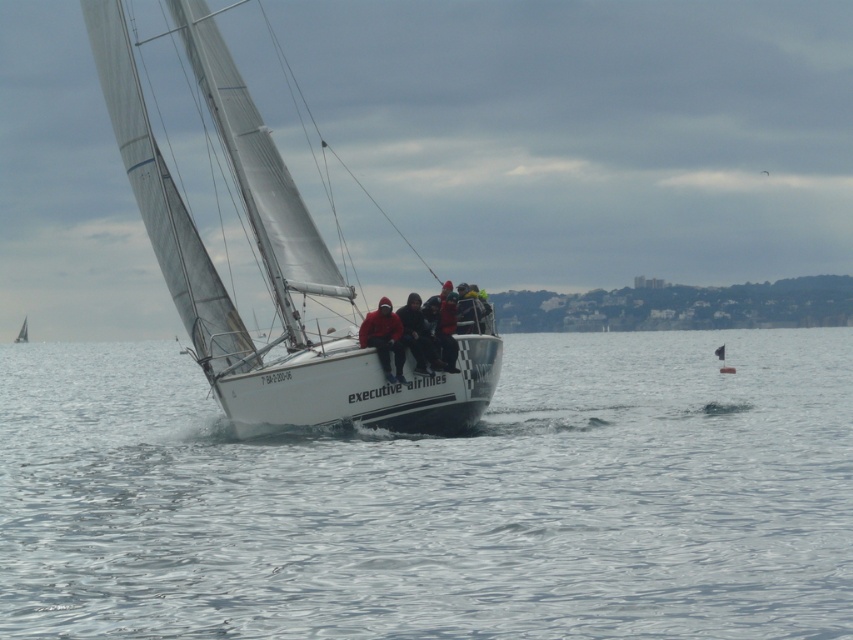
Question: Which is nearer to the clear water at sailboat front?

Choices:
 (A) dark blue fabric jacket at center
 (B) white sailboat at center

Answer: (A)

Question: Which of these objects is positioned farthest from the white matte sailboat at center?

Choices:
 (A) clear water at sailboat front
 (B) red fleece jackets at center
 (C) red fleece jacket at center

Answer: (A)

Question: Which point appears closest to the camera in this image?

Choices:
 (A) (25, 337)
 (B) (173, 216)
 (C) (366, 342)

Answer: (C)

Question: Does red fleece jacket at center have a greater width compared to dark blue fabric jacket at center?

Choices:
 (A) no
 (B) yes

Answer: (B)

Question: Can you confirm if white matte sailboat at center is wider than white sailboat at center?

Choices:
 (A) no
 (B) yes

Answer: (B)

Question: Can you confirm if red fleece jacket at center is positioned to the left of dark blue fabric jacket at center?

Choices:
 (A) yes
 (B) no

Answer: (A)